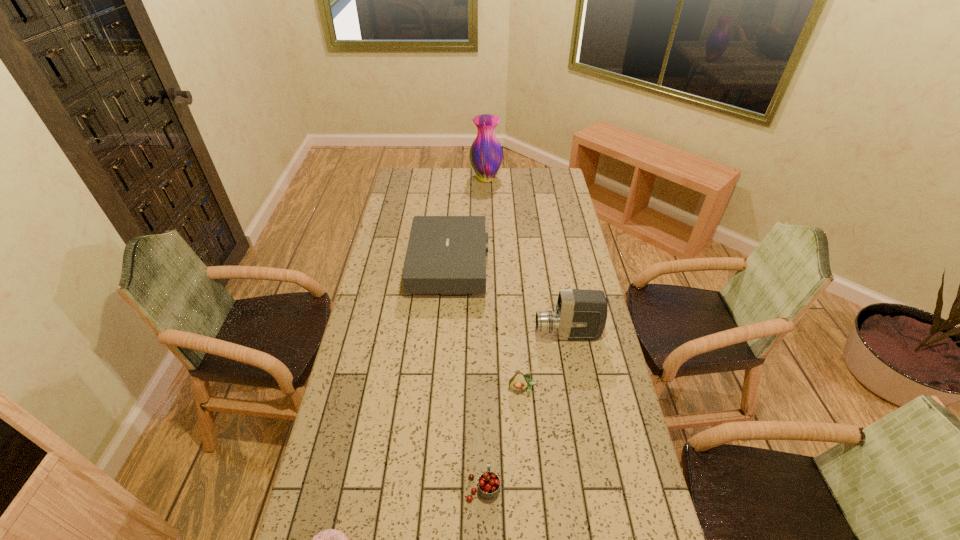
Identify the location of vacant space at the left edge of the desktop. This screenshot has width=960, height=540. (376, 252).

Locate an element on the screen. The image size is (960, 540). vacant region at the right edge of the desktop is located at coordinates click(x=638, y=525).

This screenshot has width=960, height=540. Find the location of `free space at the far right corner of the desktop`. free space at the far right corner of the desktop is located at coordinates (551, 174).

The width and height of the screenshot is (960, 540). Identify the location of vacant space that's between the avocado and the fourth shortest object. (487, 327).

Where is `unoccupied area between the second nearest object and the tallest object`? unoccupied area between the second nearest object and the tallest object is located at coordinates (485, 333).

Identify the location of free area in between the second nearest object and the projector. (467, 376).

This screenshot has height=540, width=960. I want to click on vacant space that's between the cherry and the second tallest object, so click(525, 410).

Where is `vacant space in between the vase and the rightmost object`? vacant space in between the vase and the rightmost object is located at coordinates (527, 257).

In order to click on free space between the avocado and the vase in this screenshot , I will do `click(505, 284)`.

The width and height of the screenshot is (960, 540). I want to click on free spot between the tallest object and the cherry, so click(x=485, y=333).